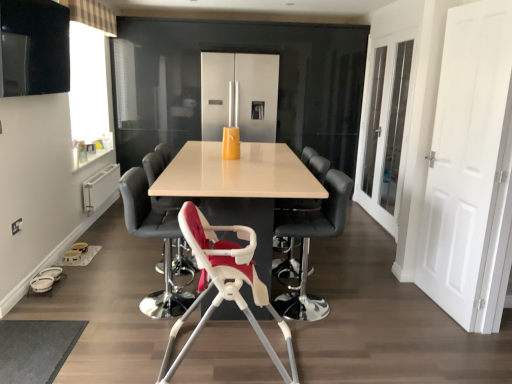
The height and width of the screenshot is (384, 512). Identify the location of free space to the right of black leather bar stool at center, placed as the third chair when sorted from front to back. [367, 306].